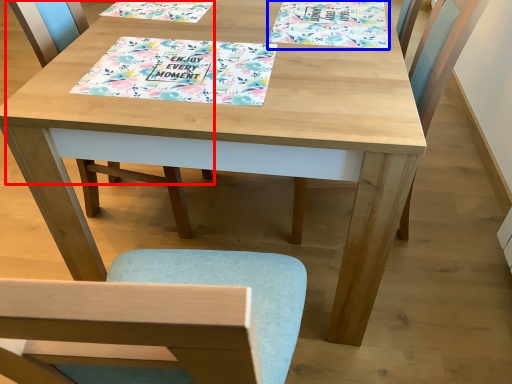
Question: Which of the following is the closest to the observer, chair (highlighted by a red box) or book cover (highlighted by a blue box)?

Choices:
 (A) chair
 (B) book cover

Answer: (A)